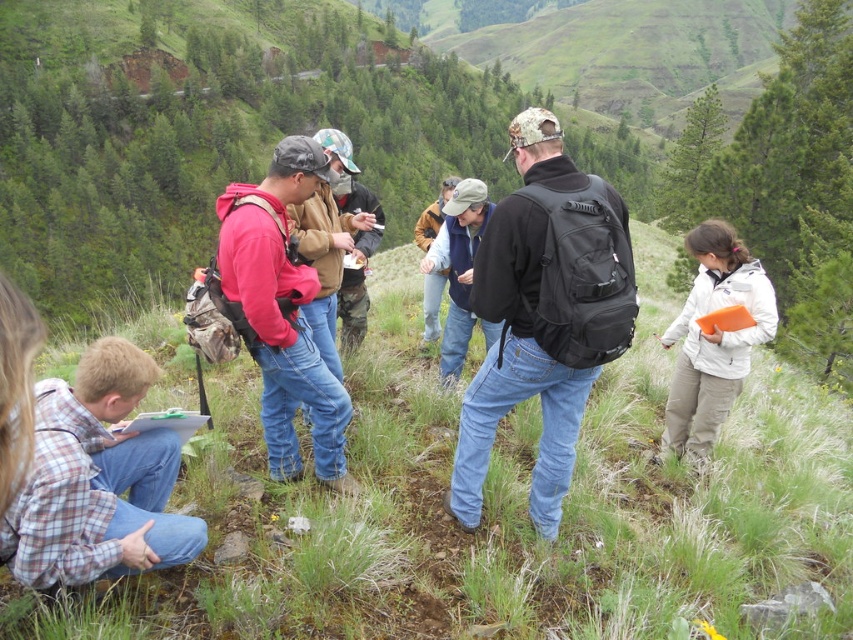
Question: Which of the following is the farthest from the observer?

Choices:
 (A) (128, 467)
 (B) (431, 314)

Answer: (B)

Question: Observing the image, what is the correct spatial positioning of plaid cotton shirt at lower left in reference to matte brown jacket at center?

Choices:
 (A) left
 (B) right

Answer: (A)

Question: Is matte red hoodie at center thinner than white matte jacket at right?

Choices:
 (A) no
 (B) yes

Answer: (A)

Question: Is denim jacket at center thinner than matte brown jacket at center?

Choices:
 (A) no
 (B) yes

Answer: (A)

Question: Which point appears closest to the camera in this image?

Choices:
 (A) (469, 241)
 (B) (28, 554)
 (C) (230, 243)
 (D) (700, 328)

Answer: (B)

Question: Which of the following is the farthest from the observer?

Choices:
 (A) (422, 340)
 (B) (619, 317)
 (C) (258, 220)

Answer: (A)